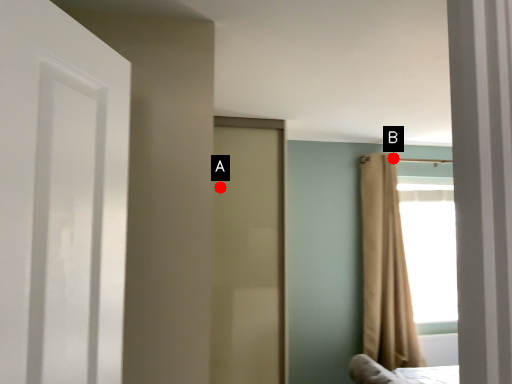
Question: Two points are circled on the image, labeled by A and B beside each circle. Which point appears farthest from the camera in this image?

Choices:
 (A) A is further
 (B) B is further

Answer: (B)